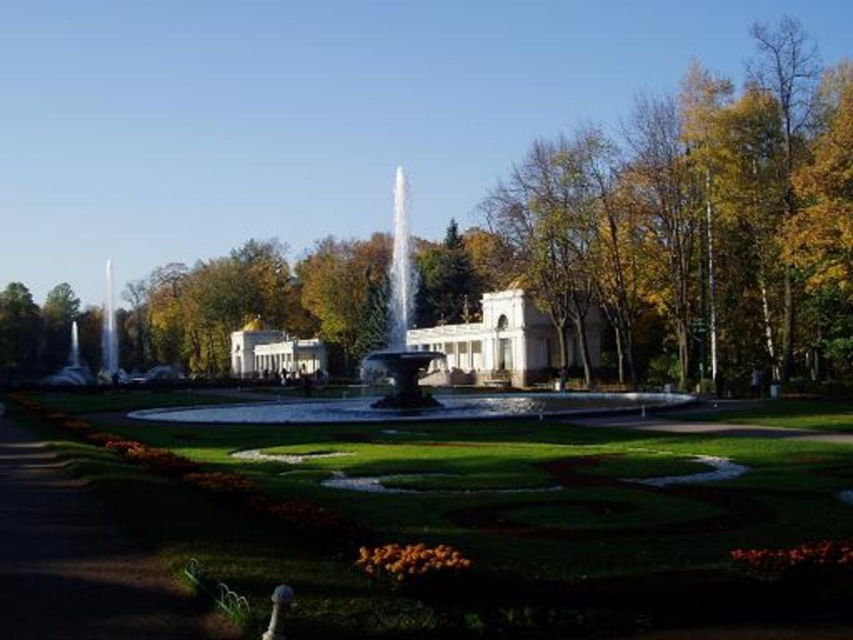
Can you confirm if green grass at lower left is smaller than shiny silver fountain at center?

Yes.

Identify the location of green grass at lower left. (78, 561).